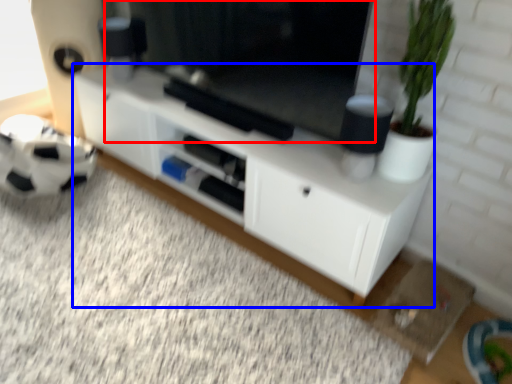
Question: Which object appears closest to the camera in this image, window screen (highlighted by a red box) or cabinetry (highlighted by a blue box)?

Choices:
 (A) window screen
 (B) cabinetry

Answer: (A)